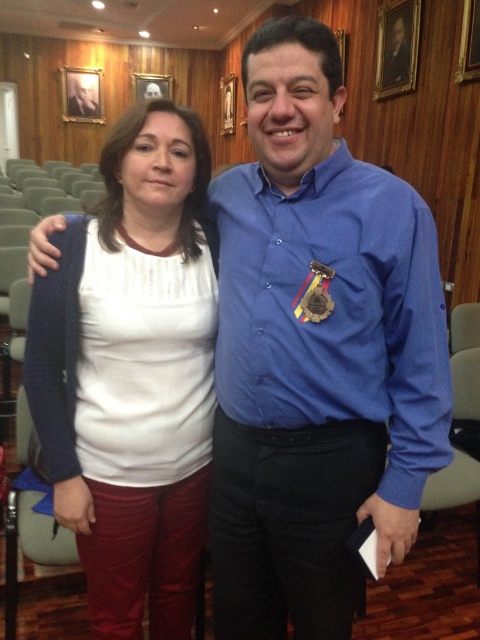
Who is more forward, (173,381) or (252,378)?

Point (252,378) is in front.

The width and height of the screenshot is (480, 640). Find the location of `white matte shirt at center`. white matte shirt at center is located at coordinates (140, 378).

The image size is (480, 640). Identify the location of white matte shirt at center. (140, 378).